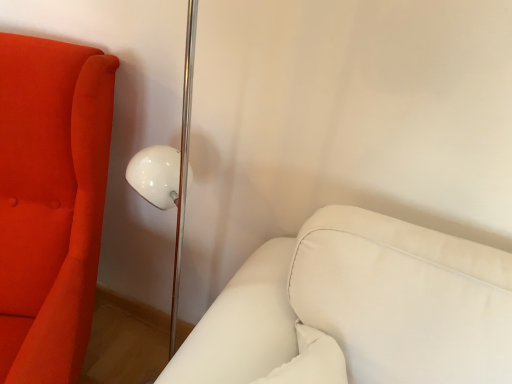
Question: Looking at their shapes, would you say white leather couch at lower right, the second furniture from the left, is wider or thinner than matte orange sofa at left, placed as the 1th furniture when sorted from left to right?

Choices:
 (A) wide
 (B) thin

Answer: (B)

Question: Looking at the image, does white leather couch at lower right, positioned as the first furniture in right-to-left order, seem bigger or smaller compared to matte orange sofa at left, the 2th furniture in the right-to-left sequence?

Choices:
 (A) small
 (B) big

Answer: (A)

Question: From a real-world perspective, is white leather couch at lower right, the second furniture from the left, above or below matte orange sofa at left, placed as the 1th furniture when sorted from left to right?

Choices:
 (A) above
 (B) below

Answer: (A)

Question: Considering their positions, is matte orange sofa at left, placed as the 1th furniture when sorted from left to right, located in front of or behind white leather couch at lower right, the second furniture from the left?

Choices:
 (A) front
 (B) behind

Answer: (A)

Question: Considering the positions of matte orange sofa at left, placed as the 1th furniture when sorted from left to right, and white leather couch at lower right, the second furniture from the left, in the image, is matte orange sofa at left, placed as the 1th furniture when sorted from left to right, bigger or smaller than white leather couch at lower right, the second furniture from the left,?

Choices:
 (A) small
 (B) big

Answer: (B)

Question: In the image, is matte orange sofa at left, placed as the 1th furniture when sorted from left to right, on the left side or the right side of white leather couch at lower right, the second furniture from the left?

Choices:
 (A) right
 (B) left

Answer: (B)

Question: From a real-world perspective, is matte orange sofa at left, the 2th furniture in the right-to-left sequence, physically located above or below white leather couch at lower right, positioned as the first furniture in right-to-left order?

Choices:
 (A) above
 (B) below

Answer: (B)